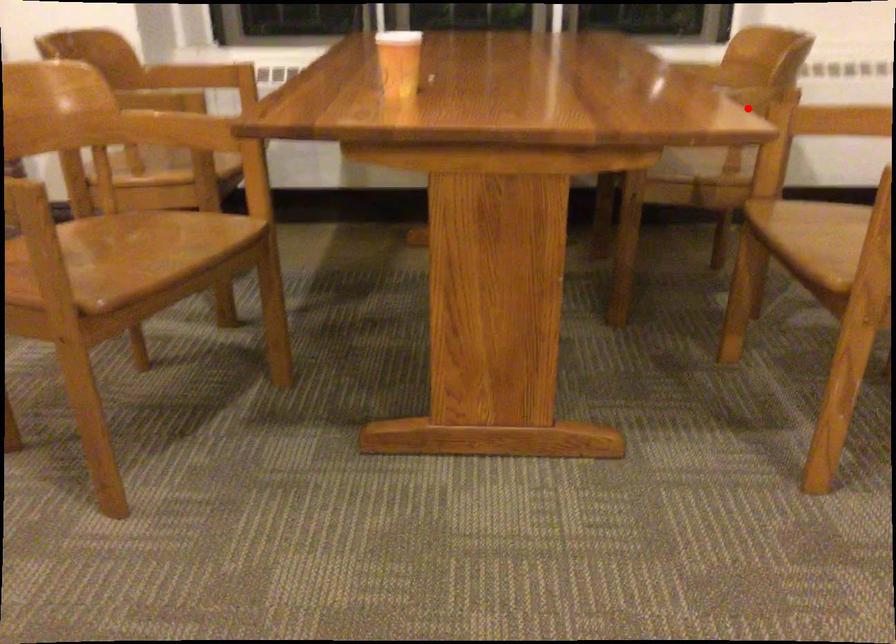
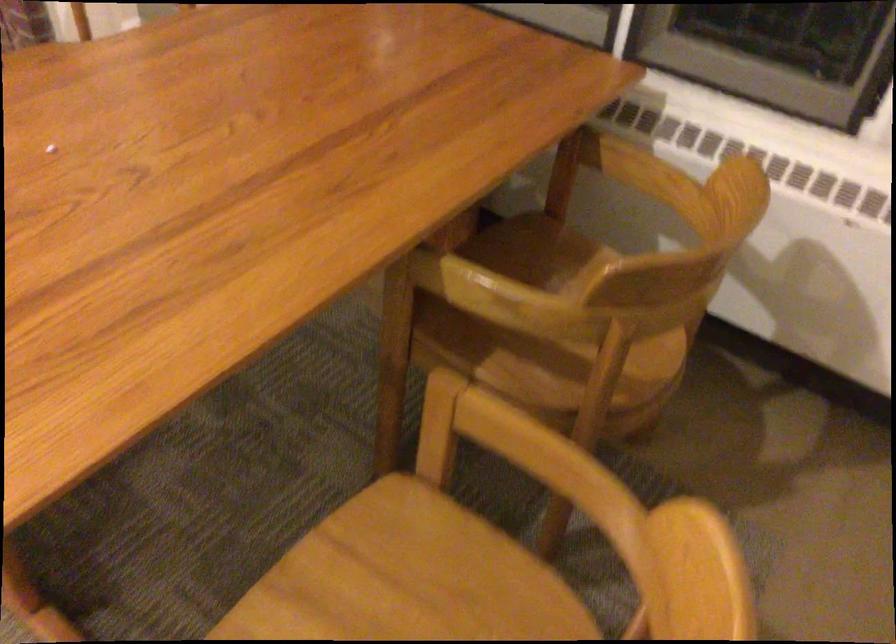
Find the pixel in the second image that matches the highlighted location in the first image.

(545, 330)